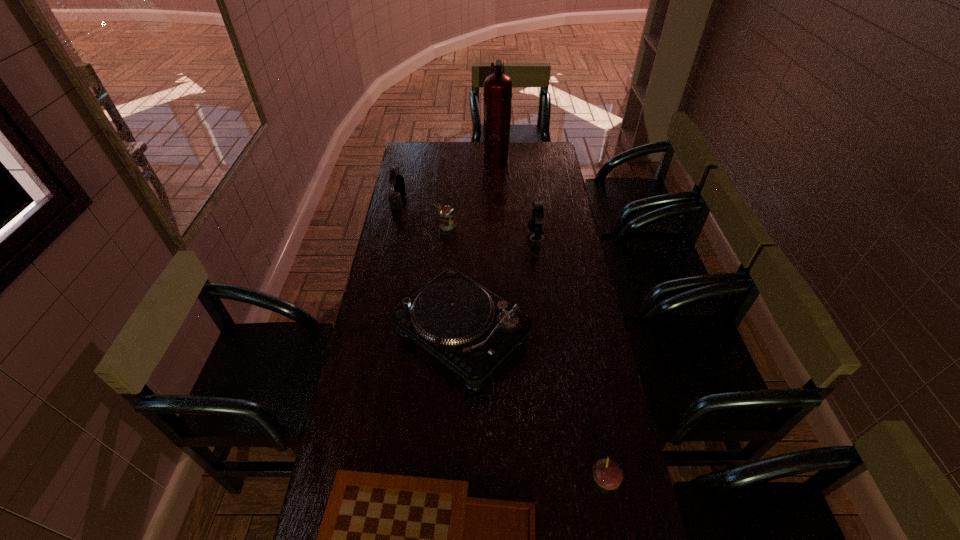
Where is `the farthest object`? The height and width of the screenshot is (540, 960). the farthest object is located at coordinates coord(497,93).

I want to click on fire extinguisher, so click(x=497, y=93).

At what (x,y) coordinates should I click in order to perform the action: click on the second farthest object. Please return your answer as a coordinate pair (x, y). This screenshot has height=540, width=960. Looking at the image, I should click on (395, 202).

At what (x,y) coordinates should I click in order to perform the action: click on the sixth object from left to right. Please return your answer as a coordinate pair (x, y). Looking at the image, I should click on (535, 224).

The image size is (960, 540). I want to click on the third nearest object, so click(x=471, y=330).

Where is `can`? Image resolution: width=960 pixels, height=540 pixels. can is located at coordinates (446, 214).

Find the location of a particular element. cupcake is located at coordinates (607, 473).

The height and width of the screenshot is (540, 960). Find the location of `vacant point located 0.400m on the nozzle side of the tallest object`. vacant point located 0.400m on the nozzle side of the tallest object is located at coordinates coord(409,153).

This screenshot has height=540, width=960. Find the location of `vacant space positioned 0.050m on the nozzle side of the tallest object`. vacant space positioned 0.050m on the nozzle side of the tallest object is located at coordinates (473, 153).

Identify the location of vacant space situated on the nozzle side of the tallest object. (468, 153).